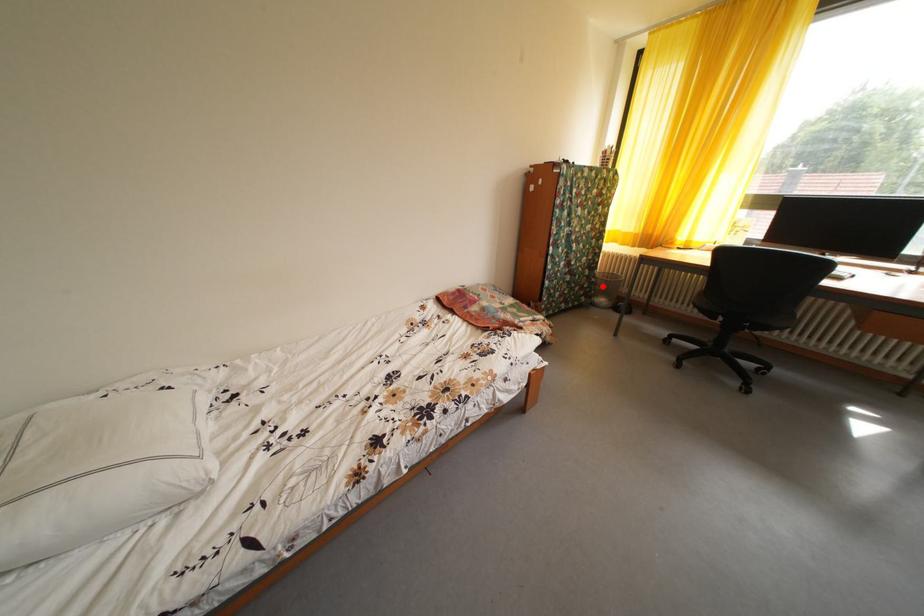
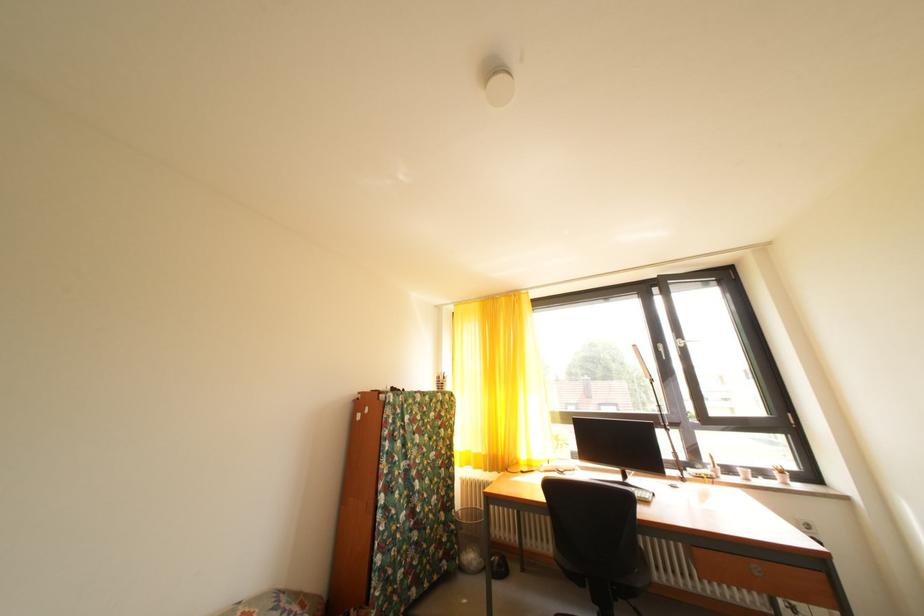
Question: I am providing you with two images of the same scene from different viewpoints. In image1, a red point is highlighted. Considering the same 3D point in image2, which of the following is correct?

Choices:
 (A) It is closer
 (B) It is farther

Answer: (B)